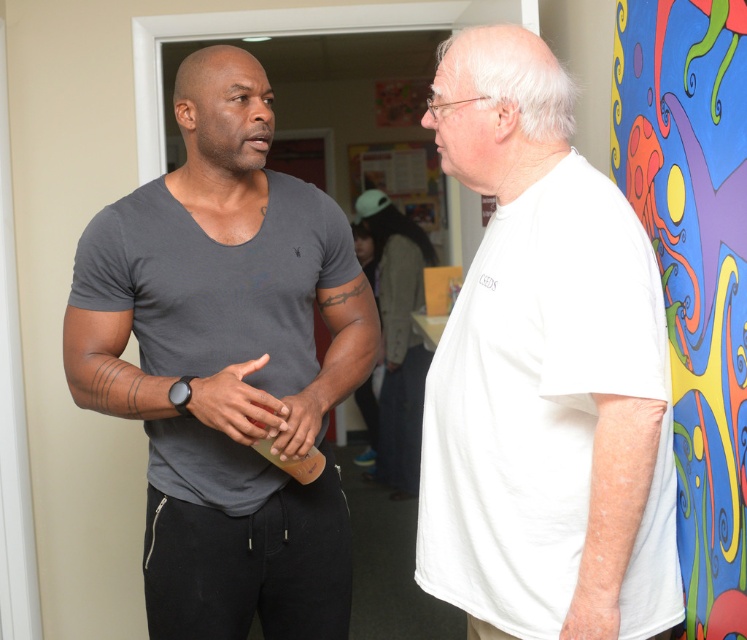
This screenshot has height=640, width=747. Describe the element at coordinates (545, 374) in the screenshot. I see `white matte t-shirt at right` at that location.

Who is more distant from viewer, (523, 348) or (202, 304)?

The point (202, 304) is behind.

What do you see at coordinates (545, 374) in the screenshot?
I see `white matte t-shirt at right` at bounding box center [545, 374].

Identify the location of white matte t-shirt at right. (545, 374).

Who is higher up, white matte t-shirt at right or multicolored painted octopus at right?

multicolored painted octopus at right is higher up.

Image resolution: width=747 pixels, height=640 pixels. What do you see at coordinates (545, 374) in the screenshot?
I see `white matte t-shirt at right` at bounding box center [545, 374].

Identify the location of white matte t-shirt at right. (545, 374).

Who is positioned more to the right, matte gray t-shirt at left or multicolored painted octopus at right?

Positioned to the right is multicolored painted octopus at right.

Based on the photo, between matte gray t-shirt at left and multicolored painted octopus at right, which one is positioned higher?

multicolored painted octopus at right is above.

Does point (294, 321) come in front of point (669, 3)?

No, (294, 321) is behind (669, 3).

This screenshot has height=640, width=747. Find the location of `matte gray t-shirt at left`. matte gray t-shirt at left is located at coordinates (226, 364).